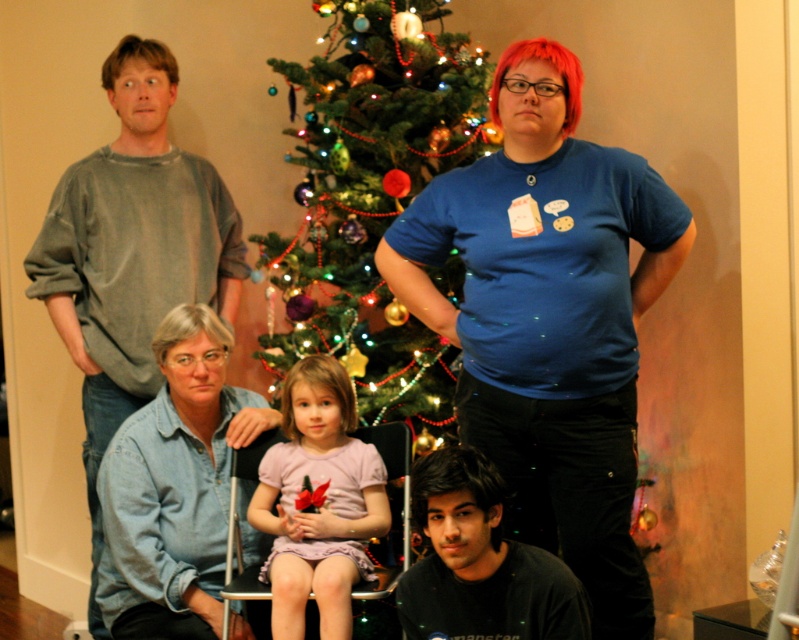
Which of these two, blue t-shirt at upper center or pink fabric dress at center, stands shorter?

With less height is pink fabric dress at center.

Does blue t-shirt at upper center appear on the left side of pink fabric dress at center?

No, blue t-shirt at upper center is not to the left of pink fabric dress at center.

Is point (527, 83) in front of point (276, 541)?

Yes, point (527, 83) is in front of point (276, 541).

Find the location of a particular element. This screenshot has width=799, height=640. blue t-shirt at upper center is located at coordinates (551, 317).

Between blue t-shirt at upper center and gray cotton shirt at upper left, which one has less height?

blue t-shirt at upper center is shorter.

Which is above, blue t-shirt at upper center or gray cotton shirt at upper left?

gray cotton shirt at upper left is above.

Does point (566, 100) lie in front of point (78, 234)?

That is True.

This screenshot has height=640, width=799. Identify the location of blue t-shirt at upper center. (551, 317).

Which of these two, blue t-shirt at upper center or black matte shirt at lower center, stands taller?

With more height is blue t-shirt at upper center.

Between blue t-shirt at upper center and black matte shirt at lower center, which one is positioned higher?

blue t-shirt at upper center

Identify the location of blue t-shirt at upper center. (551, 317).